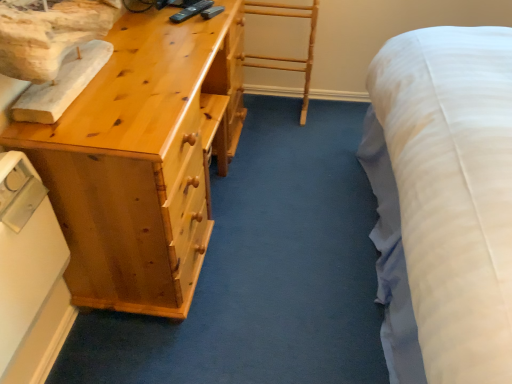
Identify the location of vacant area that is situated to the right of light wood chest of drawers at left. (301, 193).